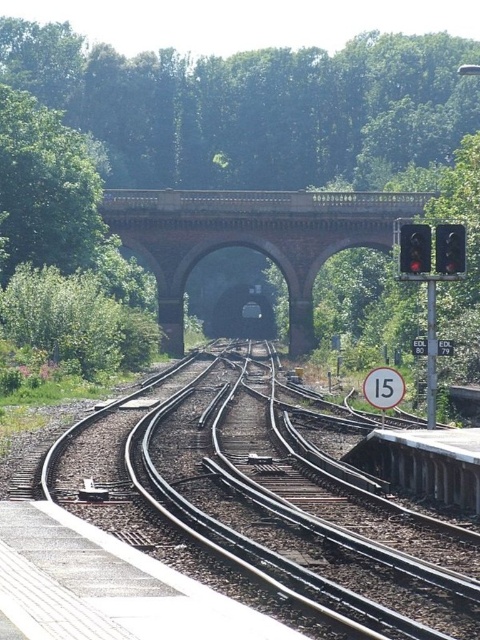
Can you confirm if brick stone bridge at center is taller than black glass traffic light at right?

Indeed, brick stone bridge at center has a greater height compared to black glass traffic light at right.

Between point (338, 218) and point (417, 253), which one is positioned behind?

The point (338, 218) is more distant.

Who is more forward, [191,227] or [421,225]?

Point [421,225]

Find the location of a particular element. This screenshot has width=480, height=640. brick stone bridge at center is located at coordinates click(250, 237).

Who is taller, brick stone bridge at center or red glass traffic light at right?

With more height is brick stone bridge at center.

What do you see at coordinates (250, 237) in the screenshot?
I see `brick stone bridge at center` at bounding box center [250, 237].

At what (x,y) coordinates should I click in order to perform the action: click on brick stone bridge at center. Please return your answer as a coordinate pair (x, y). This screenshot has height=640, width=480. Looking at the image, I should click on [x=250, y=237].

Who is positioned more to the left, metal/smooth train track at center or brick stone bridge at center?

Positioned to the left is metal/smooth train track at center.

What do you see at coordinates (254, 506) in the screenshot?
I see `metal/smooth train track at center` at bounding box center [254, 506].

Describe the element at coordinates (254, 506) in the screenshot. The height and width of the screenshot is (640, 480). I see `metal/smooth train track at center` at that location.

I want to click on metal/smooth train track at center, so click(254, 506).